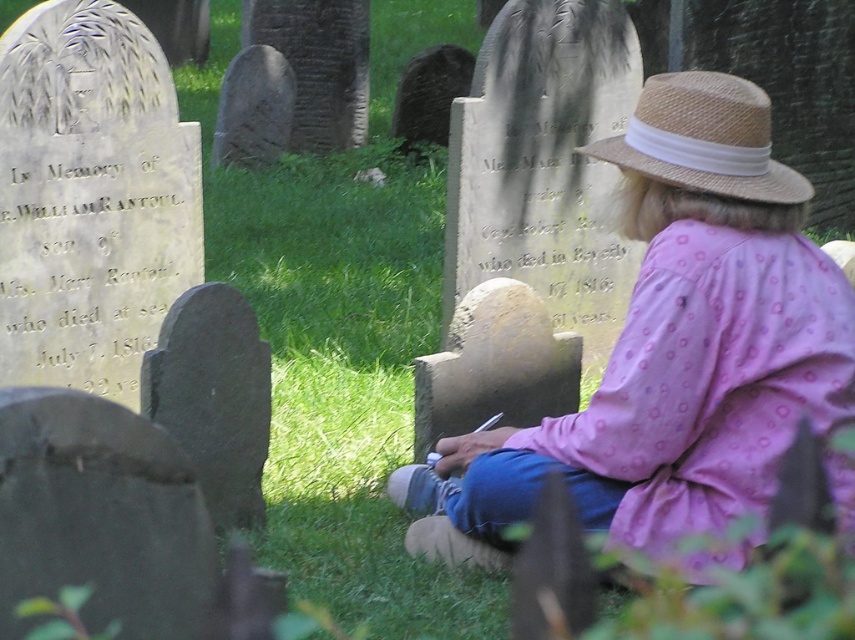
You are a photographer trying to capture both the pink dotted shirt at center and the straw hat at upper right in a single frame. Since you want to ensure both are visible, which object should you focus on to maintain clarity, considering their sizes?

The pink dotted shirt at center is bigger than the straw hat at upper right, so focusing on the pink dotted shirt at center would ensure both are visible as it occupies more space in the frame.

You are a photographer taking a picture of the pink dotted shirt at center and the straw hat at upper right. To ensure both are in frame, should you adjust your camera to the left or right?

The pink dotted shirt at center is to the left of the straw hat at upper right, so you should adjust your camera to the left to include both in the frame.

You are a photographer trying to capture the pink dotted shirt at center and the straw hat at upper right in the same frame. Which object should you zoom in on to ensure both are visible without cropping?

The pink dotted shirt at center has a larger width than the straw hat at upper right, so you should zoom in on the straw hat at upper right to include both objects in the frame.